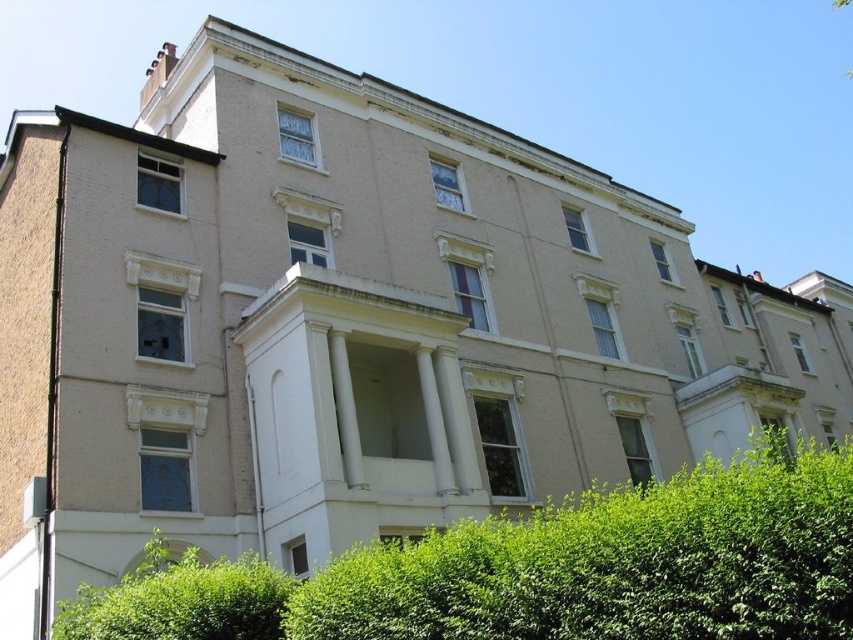
Which is below, green leafy hedge at lower center or green leafy hedge at lower left?

green leafy hedge at lower left is lower down.

Which is above, green leafy hedge at lower center or green leafy hedge at lower left?

green leafy hedge at lower center is above.

Which is in front, point (769, 600) or point (257, 592)?

Point (769, 600) is more forward.

The image size is (853, 640). In order to click on green leafy hedge at lower center in this screenshot , I will do `click(618, 563)`.